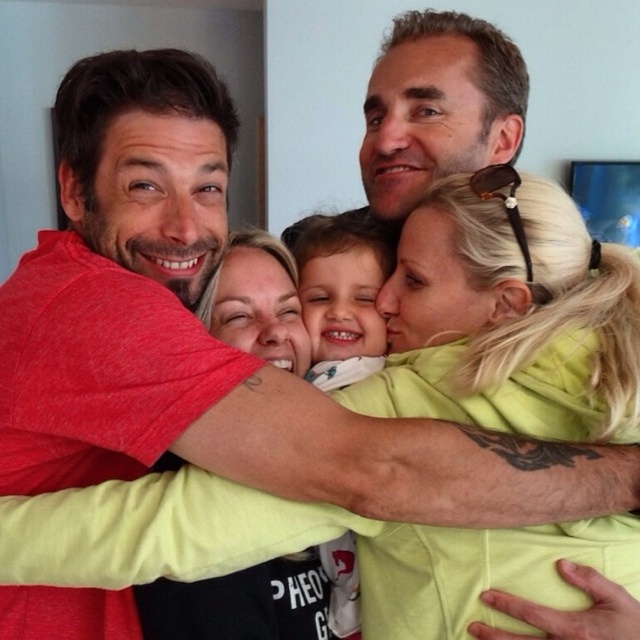
Between blonde hair at upper right and smooth white baby at center, which one appears on the left side from the viewer's perspective?

smooth white baby at center

How much distance is there between blonde hair at upper right and smooth white baby at center?

blonde hair at upper right and smooth white baby at center are 7.81 inches apart from each other.

Which is behind, point (522, 218) or point (300, 296)?

The point (300, 296) is behind.

I want to click on blonde hair at upper right, so click(509, 320).

Who is positioned more to the right, white soft fabric at center or smooth white baby at center?

From the viewer's perspective, smooth white baby at center appears more on the right side.

Which is in front, point (296, 228) or point (380, 225)?

Point (380, 225) is in front.

In order to click on white soft fabric at center in this screenshot , I will do `click(340, 292)`.

Is point (477, 310) farther from camera compared to point (346, 381)?

That is False.

Is blonde hair at upper right further to the viewer compared to white soft fabric at center?

No.

Which is in front, point (552, 262) or point (362, 260)?

Point (552, 262) is in front.

Where is `blonde hair at upper right`? The image size is (640, 640). blonde hair at upper right is located at coordinates (509, 320).